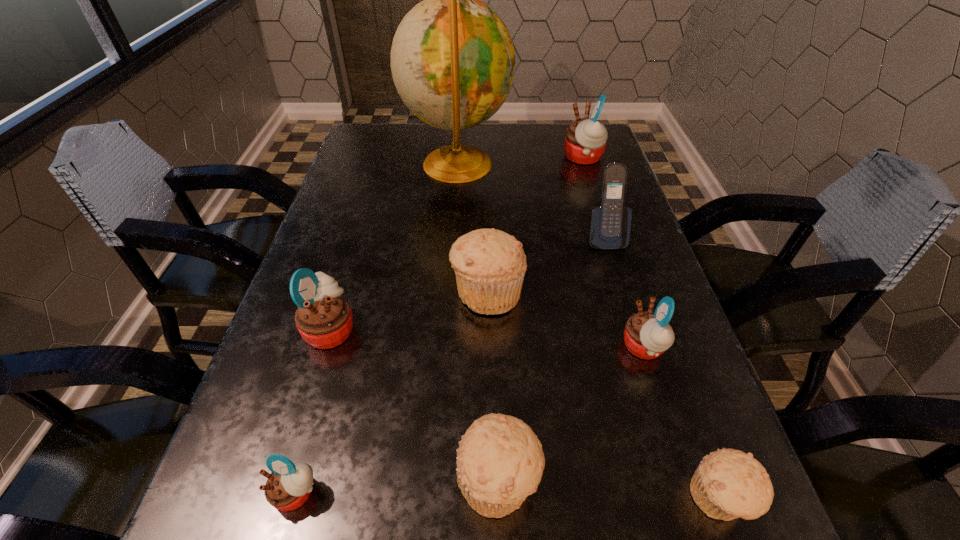
I want to click on object that is the second closest one to the globe, so click(x=610, y=224).

Choose which muffin is the second nearest neighbor to the cellular telephone. Please provide its 2D coordinates. Your answer should be formatted as a tuple, i.e. [(x, y)], where the tuple contains the x and y coordinates of a point satisfying the conditions above.

[(647, 334)]

Identify which muffin is the second nearest to the smallest pink muffin. Please provide its 2D coordinates. Your answer should be formatted as a tuple, i.e. [(x, y)], where the tuple contains the x and y coordinates of a point satisfying the conditions above.

[(324, 319)]

Point out which pink muffin is positioned as the third nearest to the tallest muffin. Please provide its 2D coordinates. Your answer should be formatted as a tuple, i.e. [(x, y)], where the tuple contains the x and y coordinates of a point satisfying the conditions above.

[(288, 487)]

At what (x,y) coordinates should I click in order to perform the action: click on pink muffin identified as the second closest to the farthest beige muffin. Please return your answer as a coordinate pair (x, y). Looking at the image, I should click on (324, 319).

This screenshot has height=540, width=960. I want to click on beige muffin that is the second closest to the second smallest pink muffin, so click(489, 264).

This screenshot has height=540, width=960. I want to click on beige muffin that can be found as the third closest to the second biggest pink muffin, so click(728, 484).

I want to click on blank space that satisfies the following two spatial constraints: 1. on the front-facing side of the second biggest pink muffin; 2. on the left side of the smallest beige muffin, so click(279, 498).

In order to click on free space that satisfies the following two spatial constraints: 1. on the front-facing side of the third biggest pink muffin; 2. on the front side of the second smallest beige muffin in this screenshot , I will do `click(686, 480)`.

Where is `free space in the image that satisfies the following two spatial constraints: 1. on the front side of the farthest beige muffin; 2. on the front-facing side of the second biggest pink muffin`? free space in the image that satisfies the following two spatial constraints: 1. on the front side of the farthest beige muffin; 2. on the front-facing side of the second biggest pink muffin is located at coordinates (488, 329).